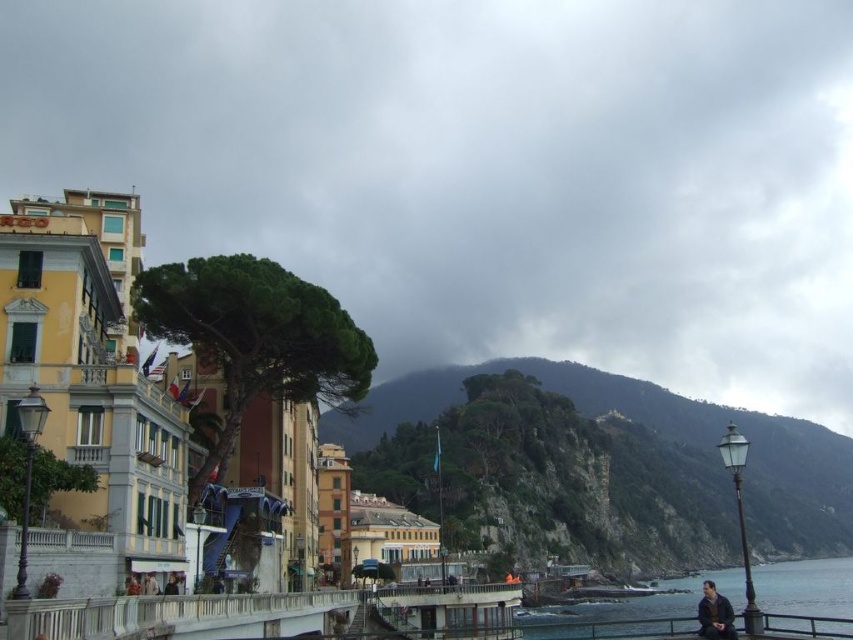
Which is more to the right, blue water at lower right or dark blue fabric jacket at lower center?

blue water at lower right

Is point (811, 612) positioned after point (166, 588)?

Yes, it is.

Locate an element on the screen. This screenshot has width=853, height=640. blue water at lower right is located at coordinates (636, 609).

Can you confirm if dark brown leather jacket at lower right is taller than dark blue fabric jacket at lower center?

Yes.

Between dark brown leather jacket at lower right and dark blue fabric jacket at lower center, which one is positioned higher?

dark blue fabric jacket at lower center

The image size is (853, 640). What do you see at coordinates (714, 614) in the screenshot?
I see `dark brown leather jacket at lower right` at bounding box center [714, 614].

I want to click on dark brown leather jacket at lower right, so click(714, 614).

Is blue water at lower right to the left of dark brown leather jacket at lower right from the viewer's perspective?

No, blue water at lower right is not to the left of dark brown leather jacket at lower right.

Is point (730, 593) closer to camera compared to point (718, 637)?

No, (730, 593) is further to viewer.

From the picture: Who is more forward, (567, 632) or (712, 618)?

Point (712, 618)

Locate an element on the screen. The image size is (853, 640). blue water at lower right is located at coordinates (636, 609).